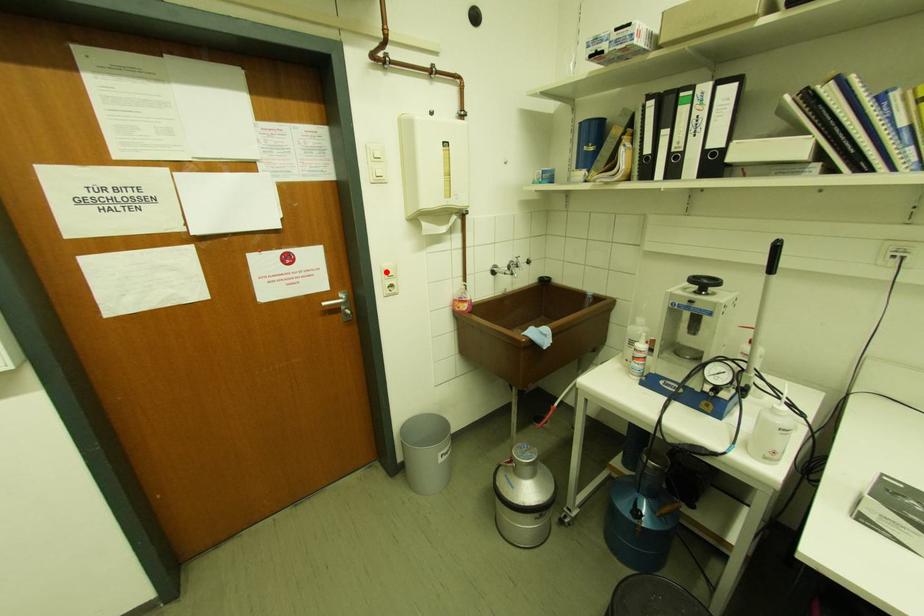
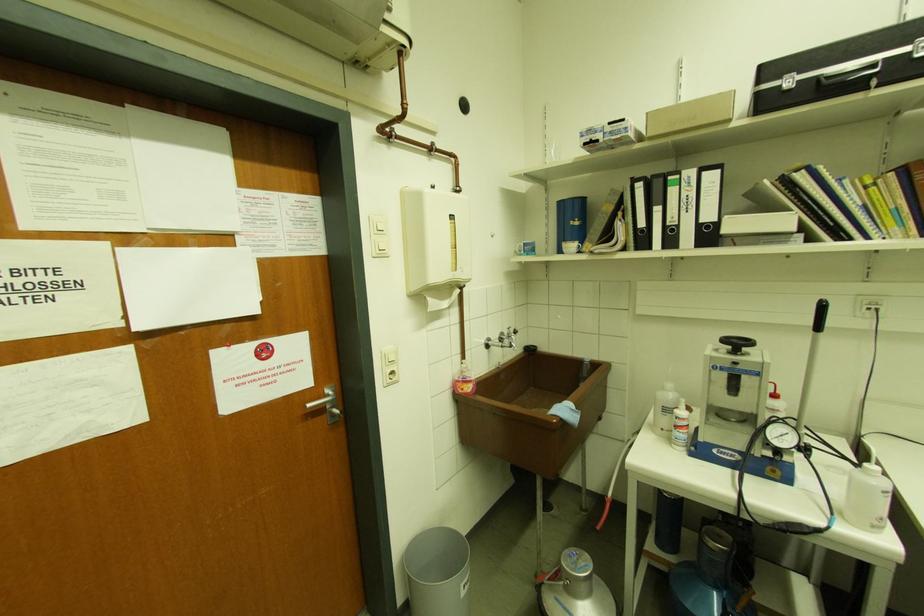
Where in the second image is the point corresponding to the highlighted location from the first image?

(387, 357)